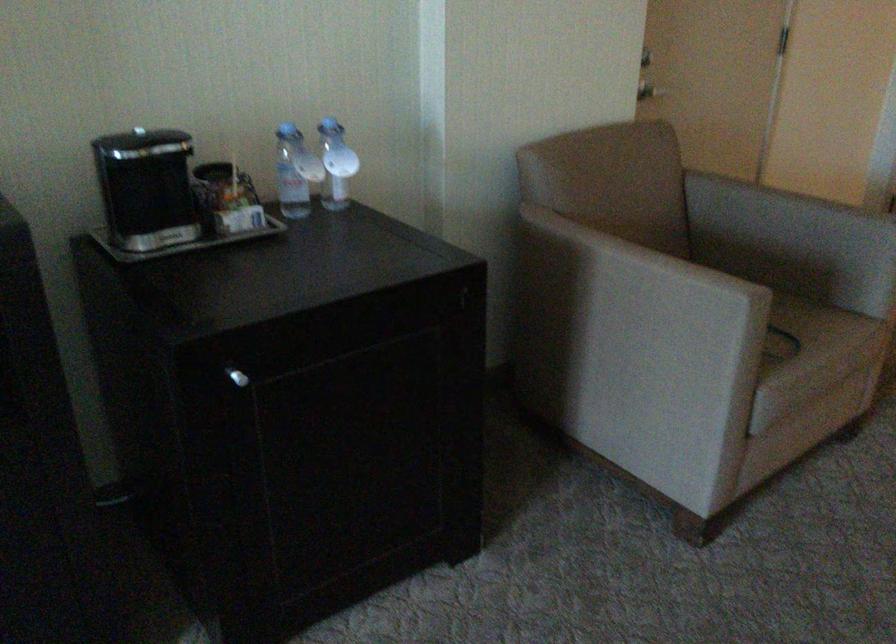
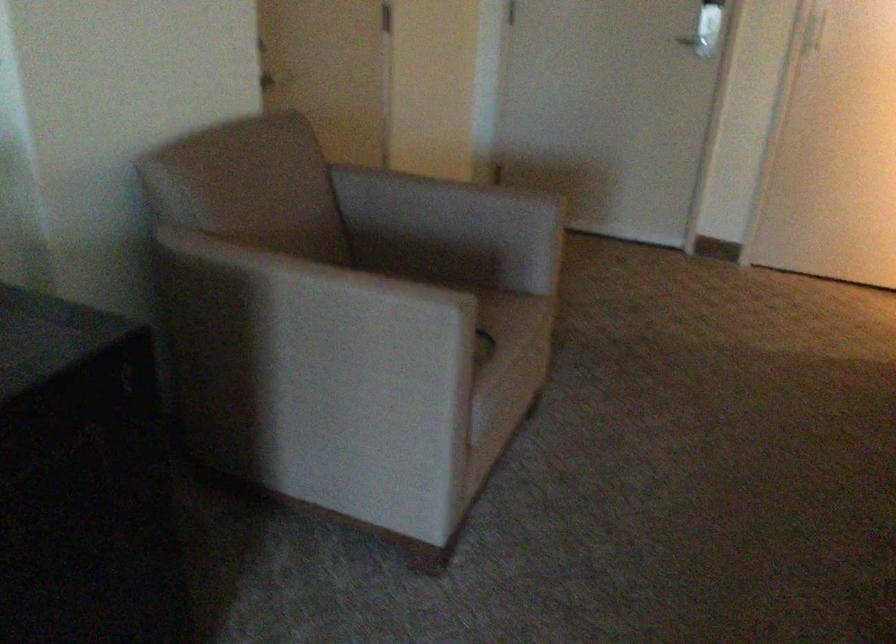
In the second image, find the point that corresponds to [823,346] in the first image.

(513, 345)